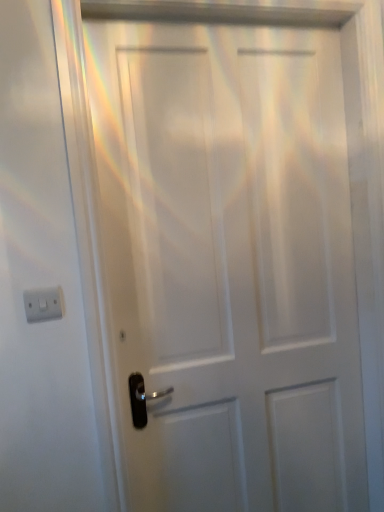
Question: From a real-world perspective, is white plastic light switch at left physically located above or below white matte door at center?

Choices:
 (A) below
 (B) above

Answer: (B)

Question: Is white plastic light switch at left taller or shorter than white matte door at center?

Choices:
 (A) tall
 (B) short

Answer: (B)

Question: Based on their positions, is white plastic light switch at left located to the left or right of white matte door at center?

Choices:
 (A) left
 (B) right

Answer: (A)

Question: Would you say white matte door at center is inside or outside white plastic light switch at left?

Choices:
 (A) inside
 (B) outside

Answer: (B)

Question: Visually, is white matte door at center positioned to the left or to the right of white plastic light switch at left?

Choices:
 (A) left
 (B) right

Answer: (B)

Question: Is white matte door at center taller or shorter than white plastic light switch at left?

Choices:
 (A) tall
 (B) short

Answer: (A)

Question: From the image's perspective, is white matte door at center positioned above or below white plastic light switch at left?

Choices:
 (A) above
 (B) below

Answer: (B)